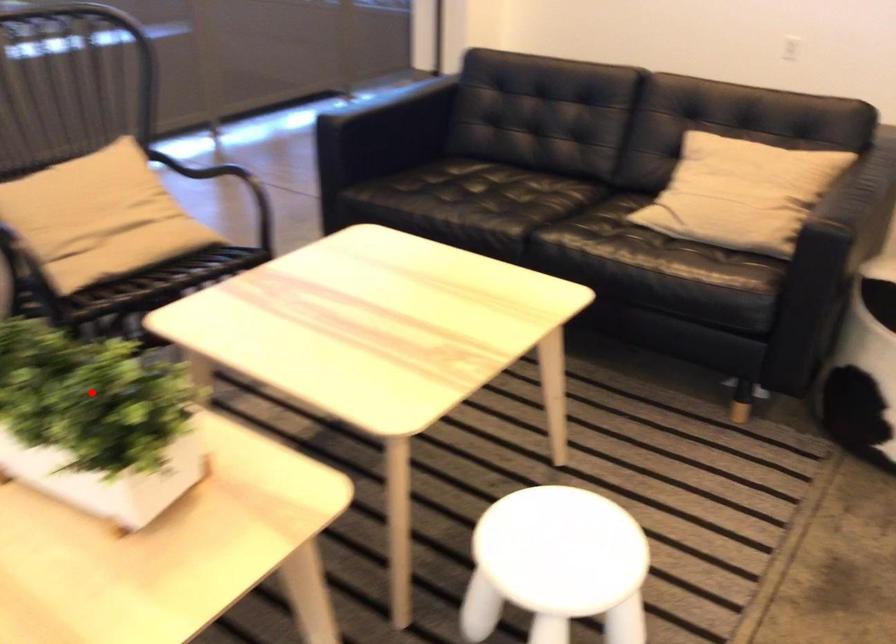
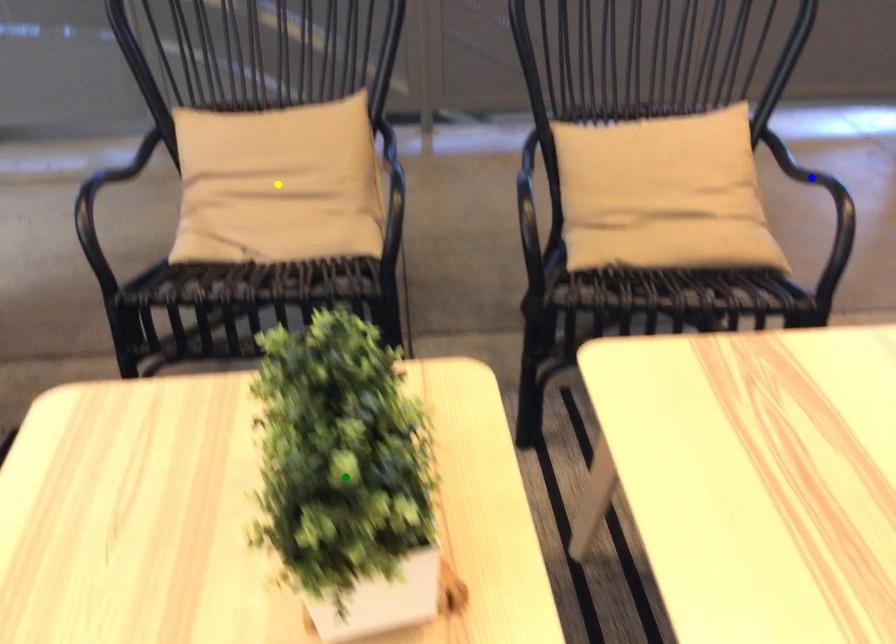
Question: I am providing you with two images of the same scene from different viewpoints. A red point is marked on the first image. You are given multiple points on the second image. Which mark in image 2 goes with the point in image 1?

Choices:
 (A) yellow point
 (B) green point
 (C) blue point

Answer: (B)